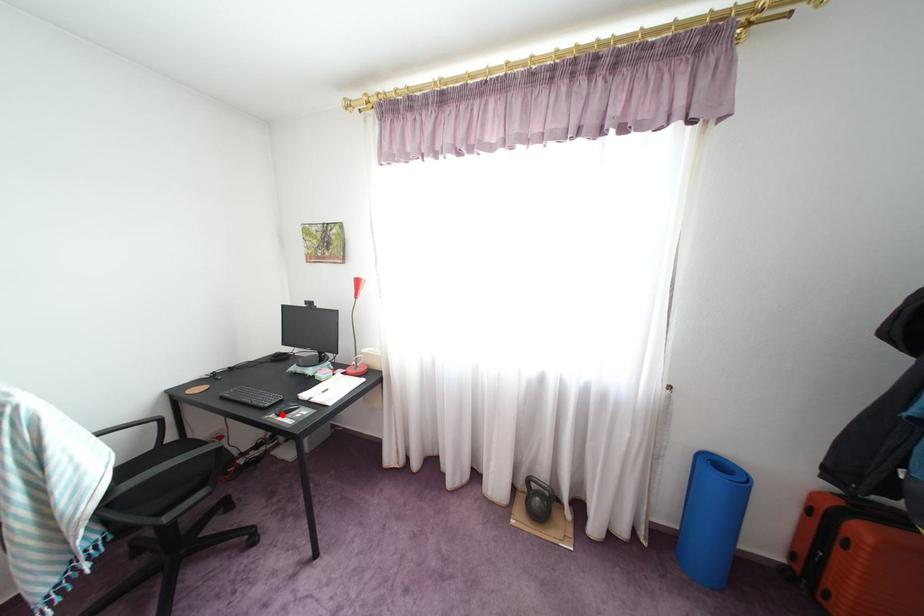
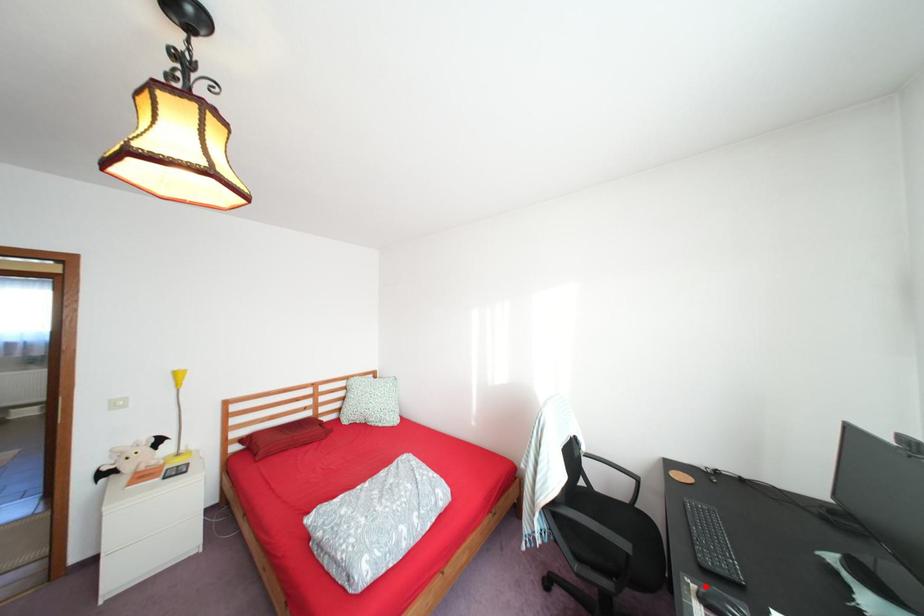
I am providing you with two images of the same scene from different viewpoints. A red point is marked on the first image and another point is marked on the second image. Is the red point in image1 aligned with the point shown in image2?

Yes